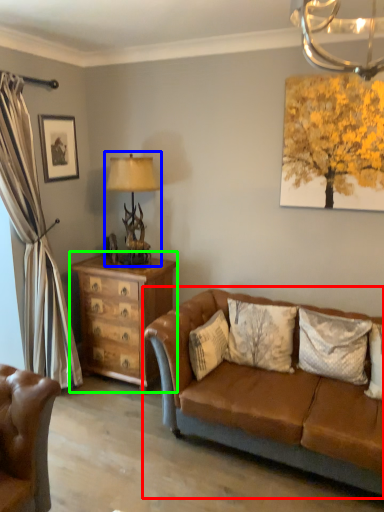
Question: Considering the real-world distances, which object is farthest from studio couch (highlighted by a red box)? table lamp (highlighted by a blue box) or chest of drawers (highlighted by a green box)?

Choices:
 (A) table lamp
 (B) chest of drawers

Answer: (A)